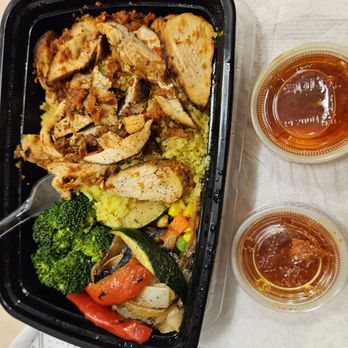
Identify the location of black plastic food container. (208, 226).